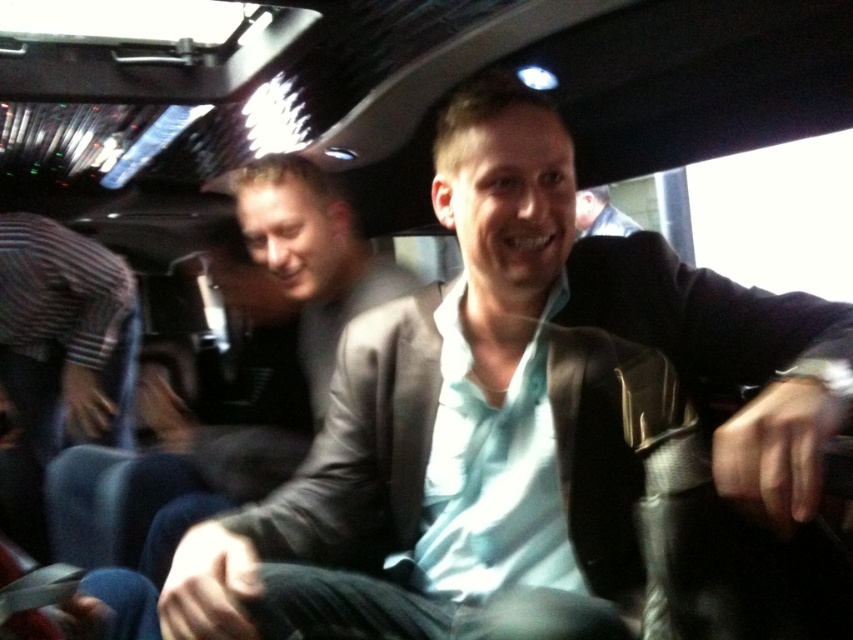
You are a passenger in a moving vehicle and need to reach for a drink placed between the striped fabric shirt at lower left and the light blue shirt at center. Which shirt should you avoid touching to keep from disturbing the person?

You should avoid touching the striped fabric shirt at lower left because it is below the light blue shirt at center, so reaching for the drink might require moving the striped fabric shirt at lower left which is closer to the drink.

You are a photographer trying to capture both the striped fabric shirt at lower left and the light blue shirt at center in a clear photo. Since the scene is slightly blurred, which shirt should you focus on to ensure it appears clearer in the photo?

The striped fabric shirt at lower left has a larger size compared to light blue shirt at center, so focusing on the striped fabric shirt at lower left would ensure it appears clearer in the photo.